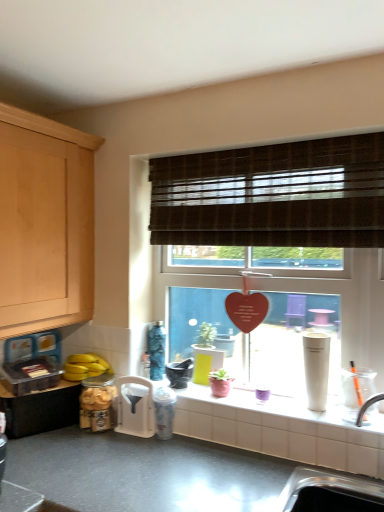
At what (x,y) coordinates should I click in order to perform the action: click on empty space that is ontop of black matte cabinet at lower left (from a real-world perspective). Please return your answer as a coordinate pair (x, y). Looking at the image, I should click on (48, 379).